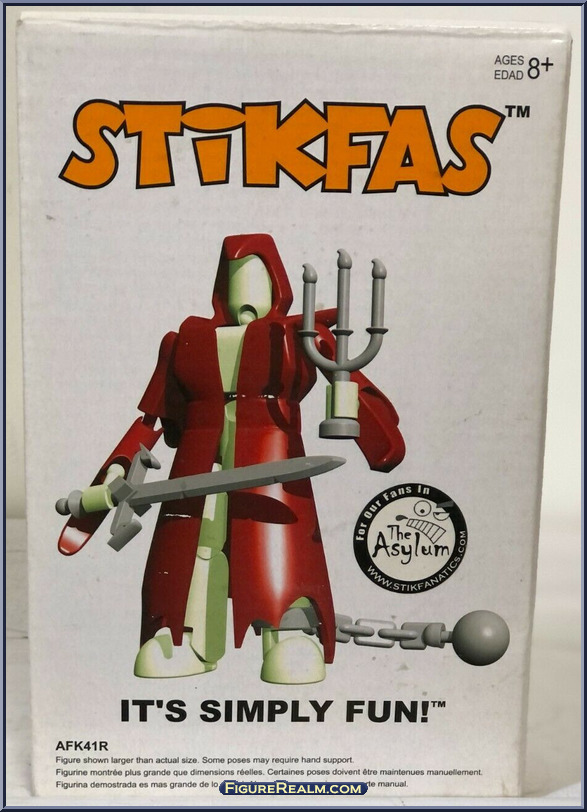
This screenshot has width=587, height=812. Identify the location of candlestick. (347, 369).